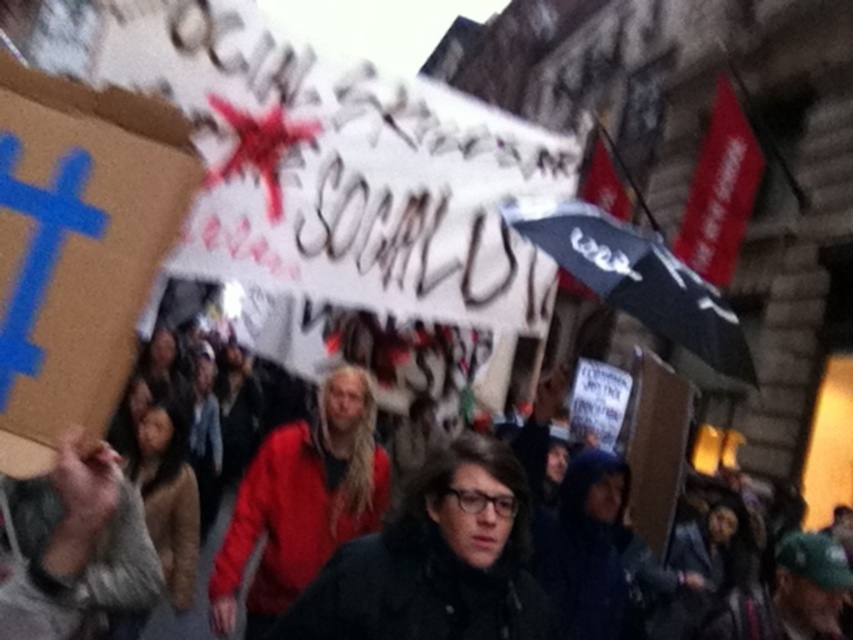
Question: Is red jacket at center positioned behind black matte umbrella at upper right?

Choices:
 (A) yes
 (B) no

Answer: (A)

Question: Among these objects, which one is nearest to the camera?

Choices:
 (A) black matte umbrella at upper right
 (B) black fabric crowd at center

Answer: (A)

Question: Estimate the real-world distances between objects in this image. Which object is closer to the black matte umbrella at upper right?

Choices:
 (A) red jacket at center
 (B) black fabric crowd at center

Answer: (A)

Question: Is red jacket at center to the right of black matte umbrella at upper right from the viewer's perspective?

Choices:
 (A) no
 (B) yes

Answer: (A)

Question: Which point is farther to the camera?

Choices:
 (A) (276, 445)
 (B) (614, 280)

Answer: (A)

Question: From the image, what is the correct spatial relationship of red jacket at center in relation to black fabric crowd at center?

Choices:
 (A) above
 (B) below

Answer: (A)